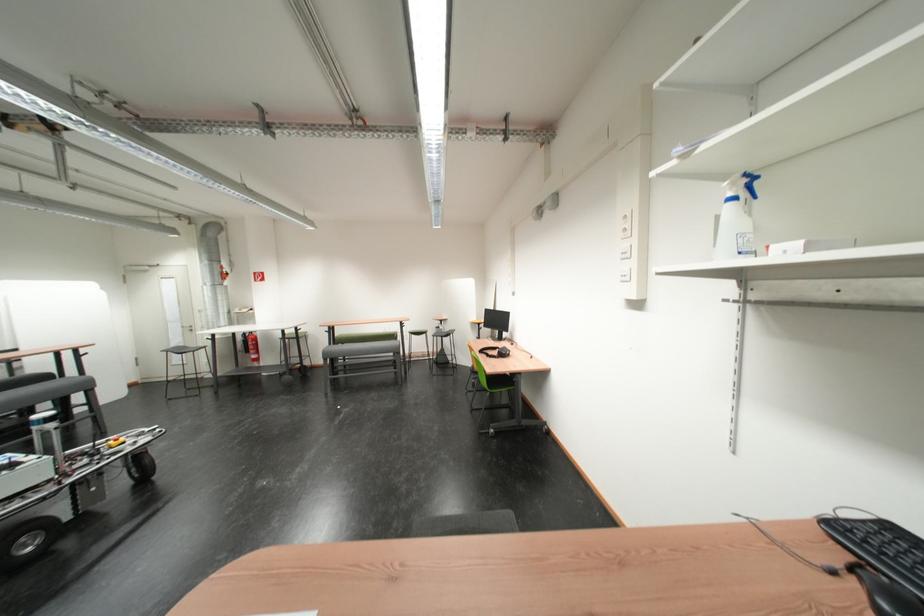
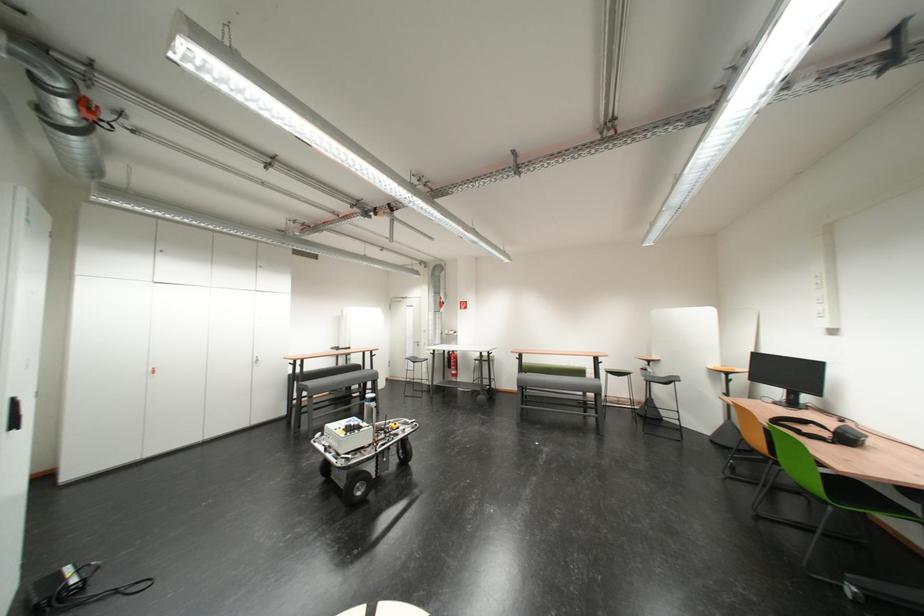
Find the pixel in the second image that matches point (342, 361) in the first image.

(532, 389)